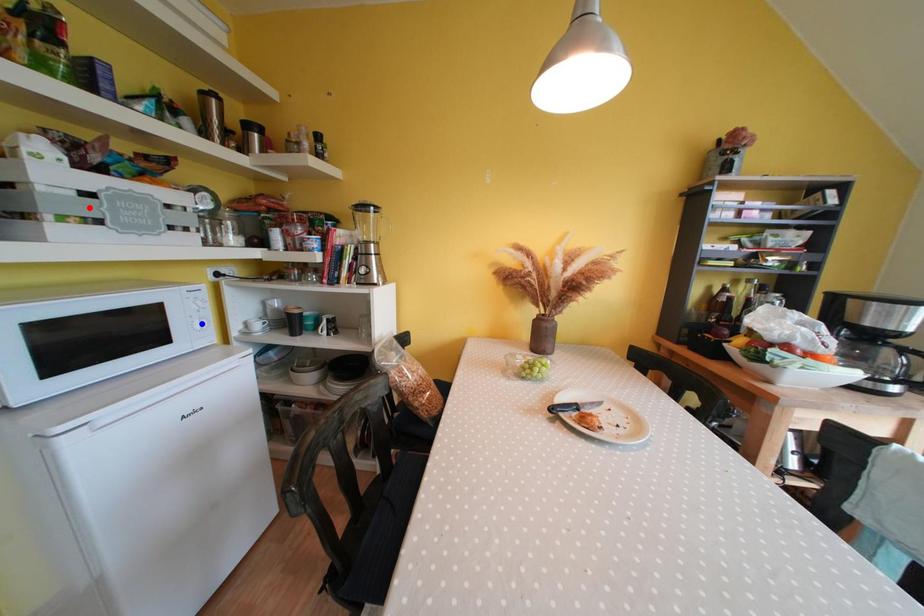
Question: In the image, two points are highlighted. Which point is nearer to the camera? Reply with the corresponding letter.

Choices:
 (A) blue point
 (B) red point

Answer: (B)